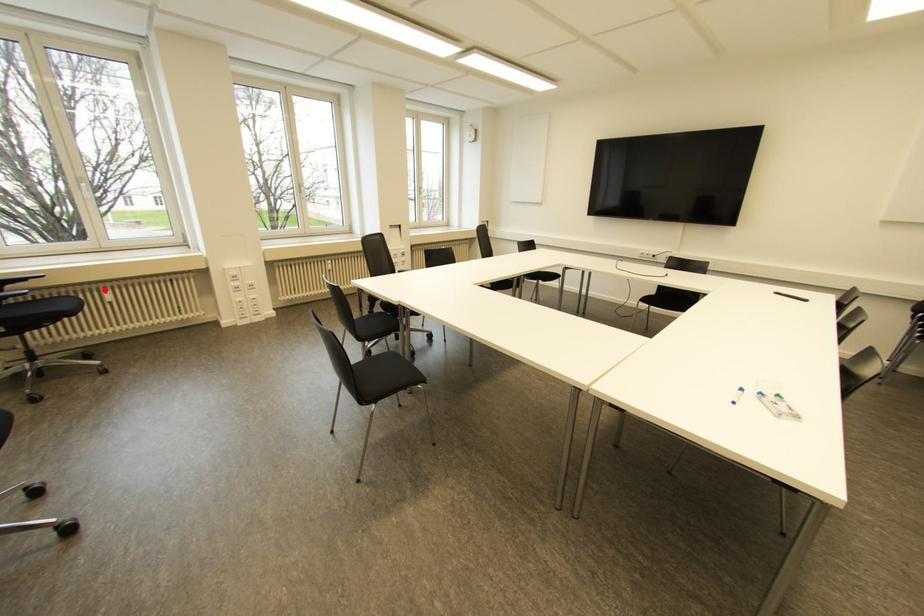
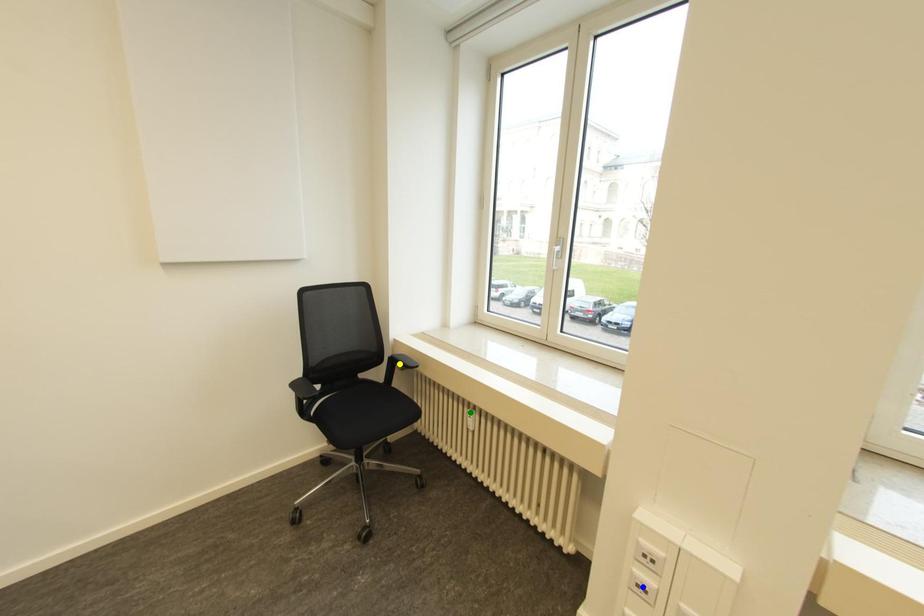
Question: I am providing you with two images of the same scene from different viewpoints. A red point is marked on the first image. You are given multiple points on the second image. Which point in image 2 is actually the same real-world point as the red point in image 1?

Choices:
 (A) yellow point
 (B) blue point
 (C) green point

Answer: (C)